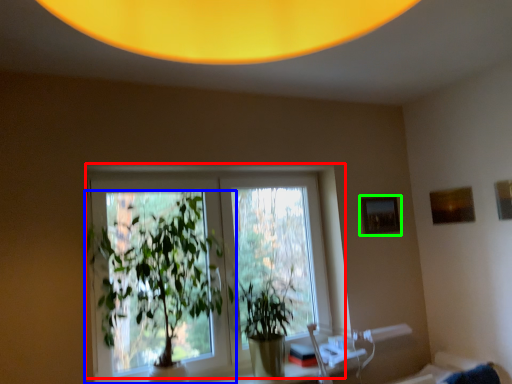
Question: Based on their relative distances, which object is nearer to window (highlighted by a red box)? Choose from houseplant (highlighted by a blue box) and picture frame (highlighted by a green box).

Choices:
 (A) houseplant
 (B) picture frame

Answer: (A)